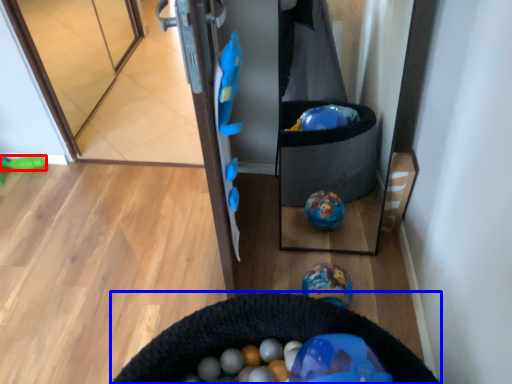
Question: Which point is closer to the camera, toy (highlighted by a red box) or cat bed (highlighted by a blue box)?

Choices:
 (A) toy
 (B) cat bed

Answer: (B)